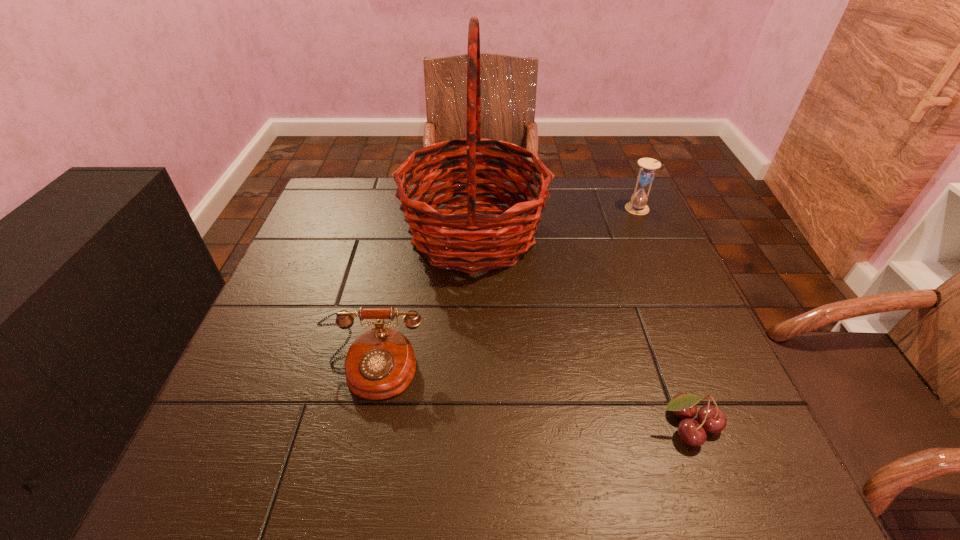
The image size is (960, 540). Find the location of `the tallest object`. the tallest object is located at coordinates (452, 234).

Identify the location of hourglass. Image resolution: width=960 pixels, height=540 pixels. (646, 174).

The width and height of the screenshot is (960, 540). In order to click on telephone in this screenshot , I will do `click(380, 364)`.

I want to click on the second nearest object, so click(x=380, y=364).

Find the location of a particular element. cherry is located at coordinates (712, 419).

Identify the location of the nearest object. (712, 419).

Where is `vacant space located 0.160m on the front of the basket`? The width and height of the screenshot is (960, 540). vacant space located 0.160m on the front of the basket is located at coordinates (471, 336).

Identify the location of vacant point located on the front of the hourglass. (649, 235).

At what (x,y) coordinates should I click in order to perform the action: click on vacant space located 0.050m on the dial of the third farthest object. Please return your answer as a coordinate pair (x, y). The image size is (960, 540). Looking at the image, I should click on (360, 427).

In order to click on vacant region located on the leaves of the cherry in this screenshot , I will do `click(709, 483)`.